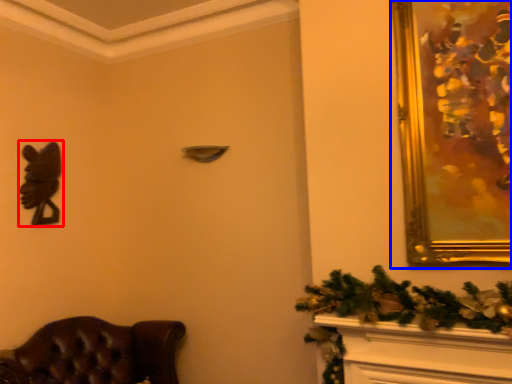
Question: Which of the following is the farthest to the observer, animal (highlighted by a red box) or picture frame (highlighted by a blue box)?

Choices:
 (A) animal
 (B) picture frame

Answer: (A)